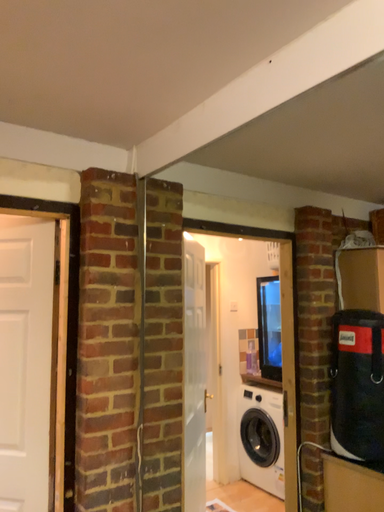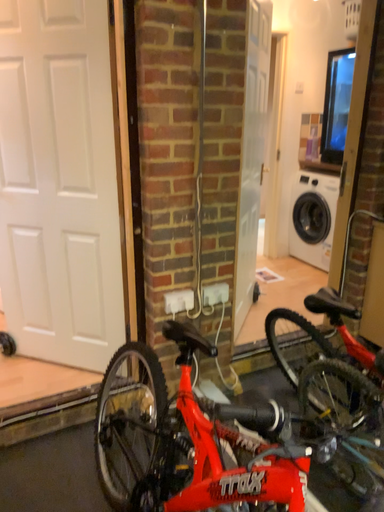
Question: Which way did the camera rotate in the video?

Choices:
 (A) rotated upward
 (B) rotated downward

Answer: (B)